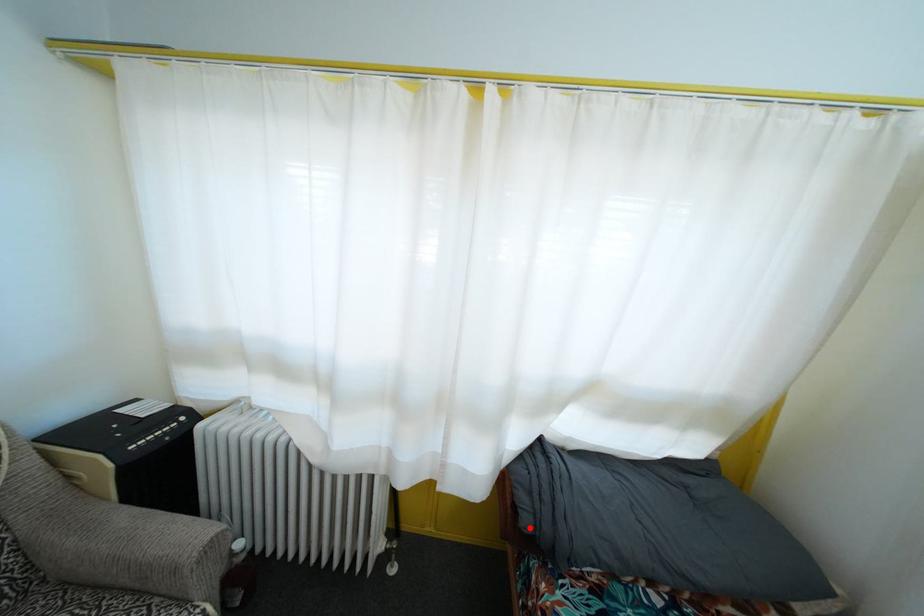
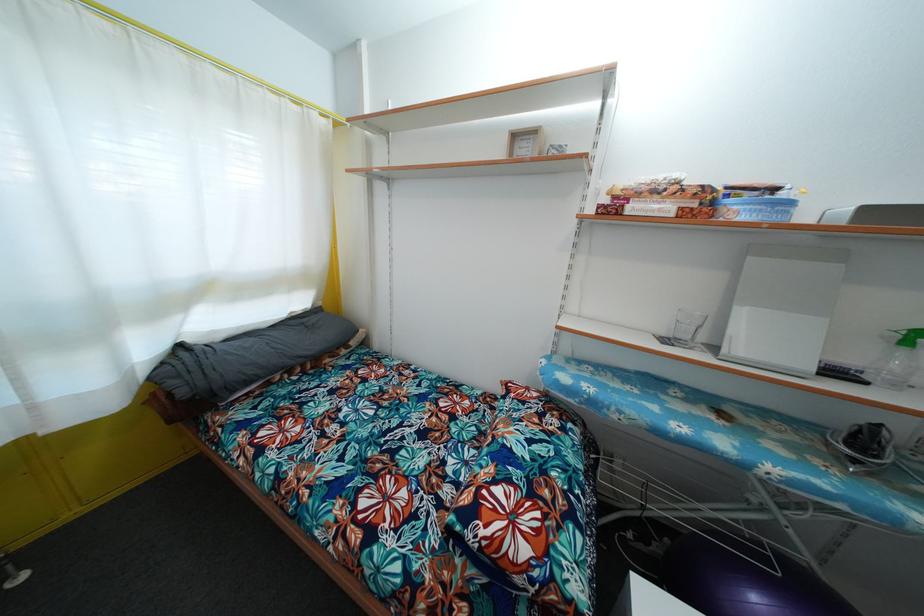
Find the pixel in the second image that matches the highlighted location in the first image.

(187, 399)